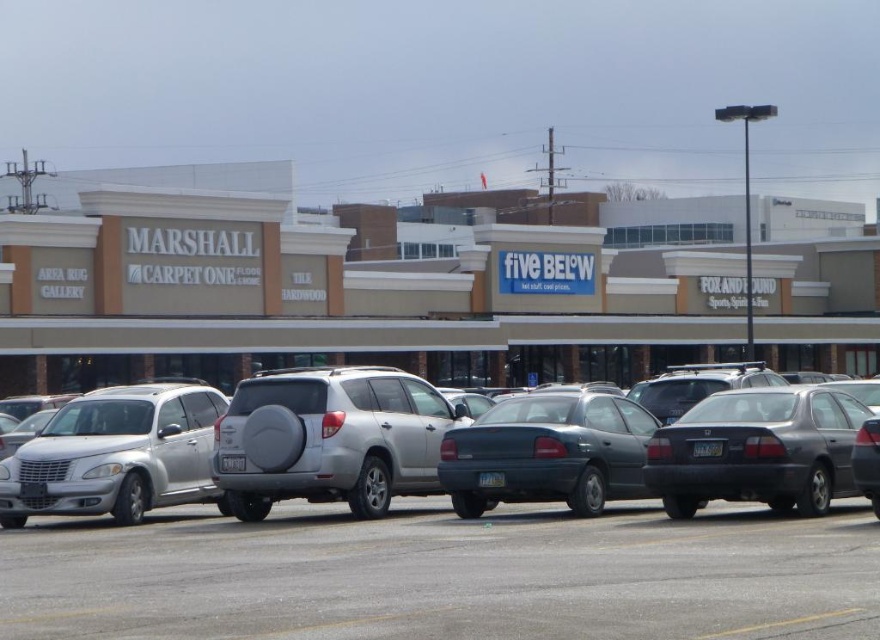
Question: Where is silver metallic suv at center located in relation to dark gray sedan at center in the image?

Choices:
 (A) right
 (B) left

Answer: (B)

Question: Based on their relative distances, which object is farther from the gray asphalt at lower center?

Choices:
 (A) silver metallic suv at left
 (B) dark gray matte sedan at center
 (C) silver metallic sedan at center

Answer: (A)

Question: Which of the following is the closest to the observer?

Choices:
 (A) (290, 458)
 (B) (297, 512)
 (C) (854, 477)

Answer: (C)

Question: Can you confirm if silver metallic suv at left is positioned to the left of matte gray sedan at right?

Choices:
 (A) no
 (B) yes

Answer: (B)

Question: Which object appears farthest from the camera in this image?

Choices:
 (A) silver metallic suv at center
 (B) matte gray sedan at right

Answer: (A)

Question: Is silver metallic suv at left to the left of dark gray sedan at center from the viewer's perspective?

Choices:
 (A) no
 (B) yes

Answer: (B)